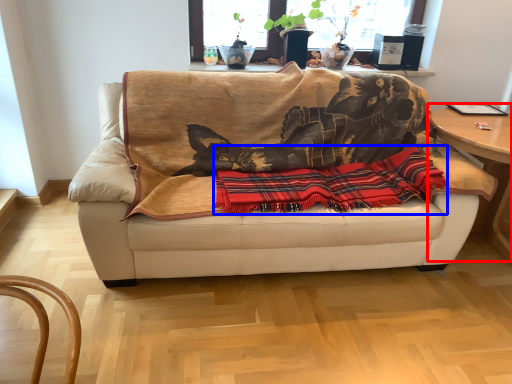
Question: Which object appears farthest to the camera in this image, table (highlighted by a red box) or plaid (highlighted by a blue box)?

Choices:
 (A) table
 (B) plaid

Answer: (A)